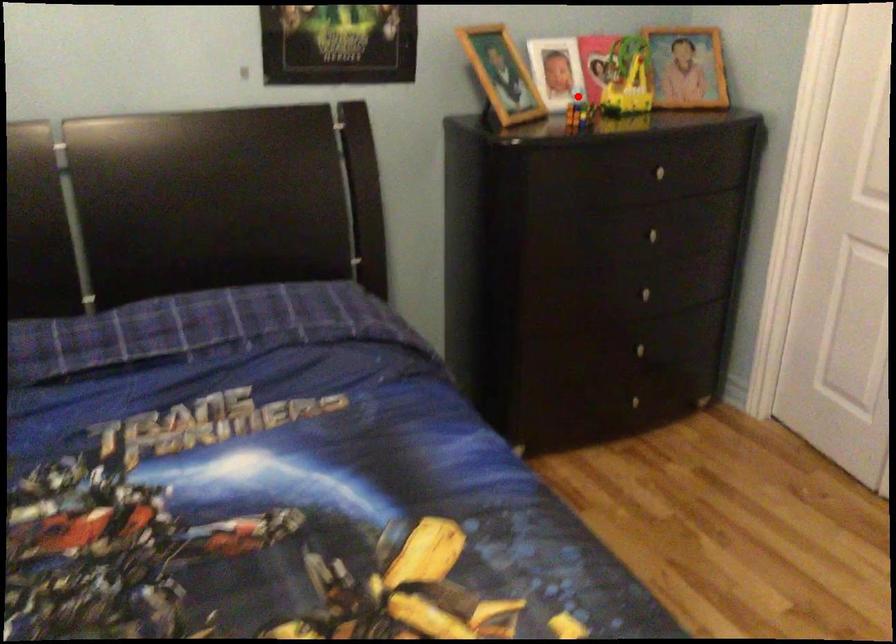
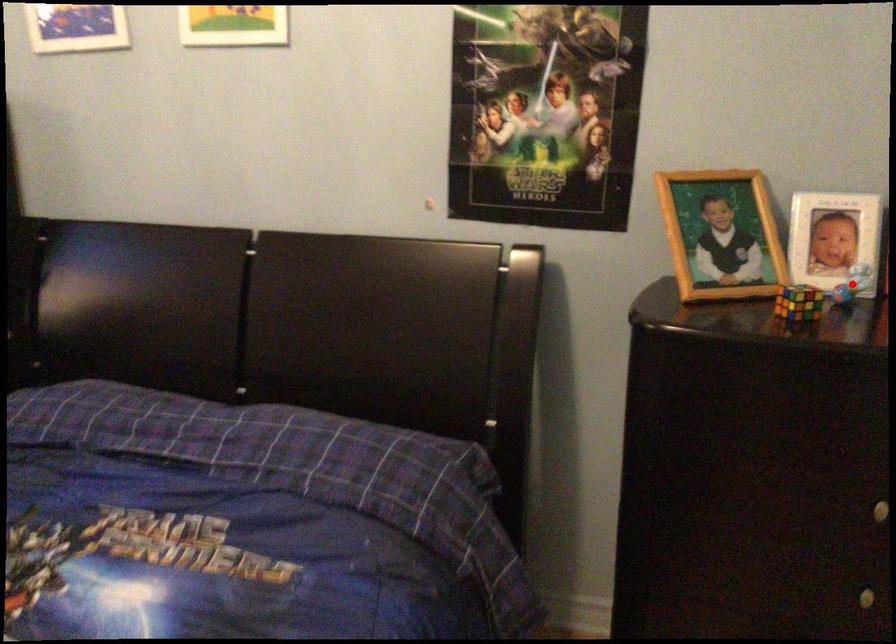
I am providing you with two images of the same scene from different viewpoints. A red point is marked on the first image and another point is marked on the second image. Is the marked point in image1 the same physical position as the marked point in image2?

Yes